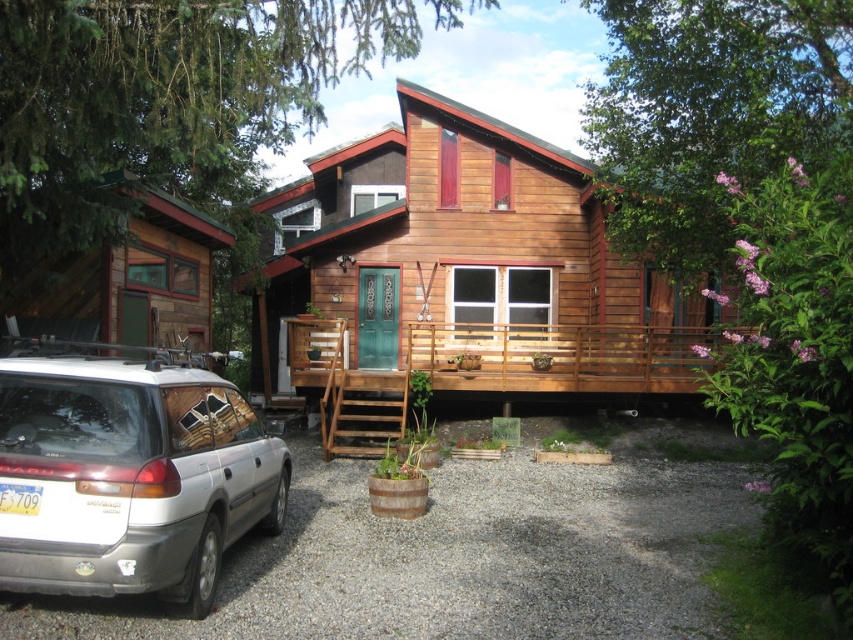
You are planning to build a new shed and want to ensure it matches the height of the existing structures. Looking at the wooden cabin at center and the wooden cabin at left in the image, which one should you use as a reference for the shed height?

The wooden cabin at center is much taller than the wooden cabin at left, so you should use the wooden cabin at center as a reference for the shed height to ensure it matches the taller structure.

You are standing in a field and see the wooden cabin at center and the silver metallic car at lower left. Which object is closer to you?

The wooden cabin at center is closer to you because it is further to the viewer than the silver metallic car at lower left.